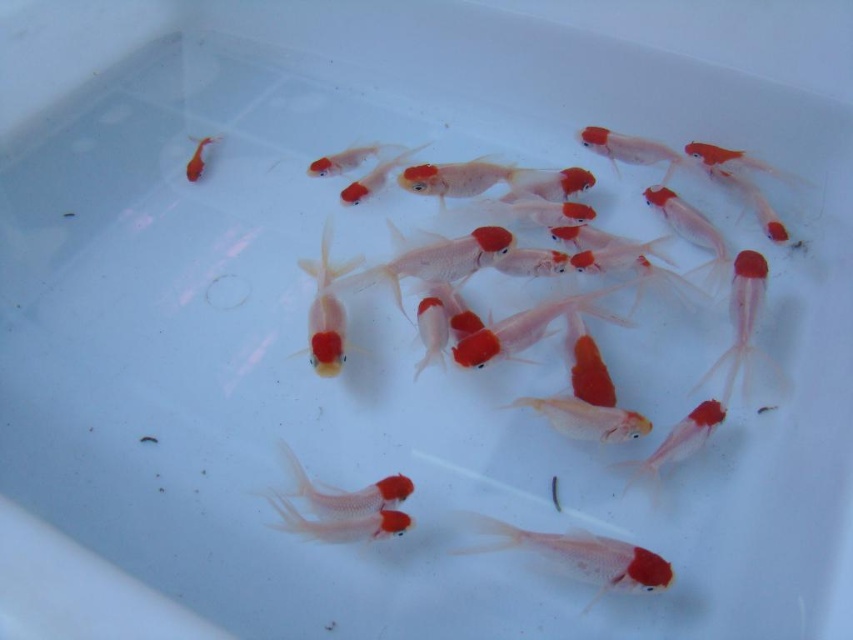
Which is below, translucent white goldfish at center or matte orange goldfish at upper left?

translucent white goldfish at center

Who is higher up, translucent white goldfish at center or matte orange goldfish at upper left?

matte orange goldfish at upper left is higher up.

This screenshot has height=640, width=853. I want to click on translucent white goldfish at center, so click(578, 556).

Is matte white goldfish at center shorter than matte orange goldfish at upper left?

Indeed, matte white goldfish at center has a lesser height compared to matte orange goldfish at upper left.

From the picture: Does matte white goldfish at center appear over matte orange goldfish at upper left?

No.

Locate an element on the screen. matte white goldfish at center is located at coordinates (345, 490).

Between point (601, 582) and point (396, 493), which one is positioned behind?

Point (396, 493)

Between translucent white goldfish at center and matte white goldfish at center, which one appears on the right side from the viewer's perspective?

translucent white goldfish at center

Find the location of `translucent white goldfish at center`. translucent white goldfish at center is located at coordinates (578, 556).